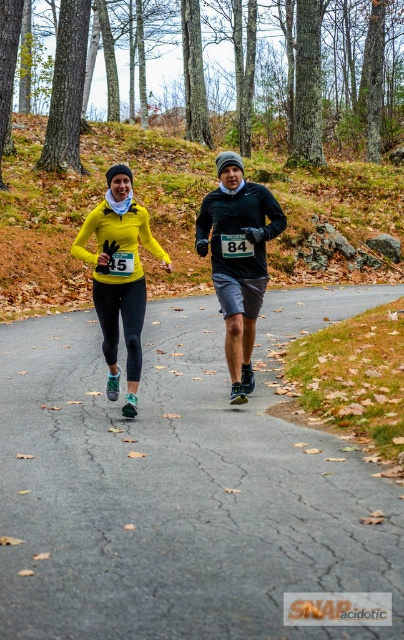
Question: Does yellow matte running top at center appear over matte yellow jacket at center?

Choices:
 (A) no
 (B) yes

Answer: (B)

Question: Can you confirm if matte asphalt road at center is positioned to the right of matte yellow jacket at center?

Choices:
 (A) yes
 (B) no

Answer: (A)

Question: Which of the following is the closest to the observer?

Choices:
 (A) (237, 170)
 (B) (124, 317)
 (C) (79, 579)
 (D) (237, 160)

Answer: (C)

Question: Which of the following is the closest to the observer?

Choices:
 (A) (242, 372)
 (B) (84, 564)
 (C) (143, 296)
 (D) (107, 346)

Answer: (B)

Question: Can you confirm if yellow matte running top at center is bigger than matte yellow jacket at center?

Choices:
 (A) no
 (B) yes

Answer: (A)

Question: Which point is closer to the camera?

Choices:
 (A) (124, 282)
 (B) (246, 333)
 (C) (130, 294)

Answer: (C)